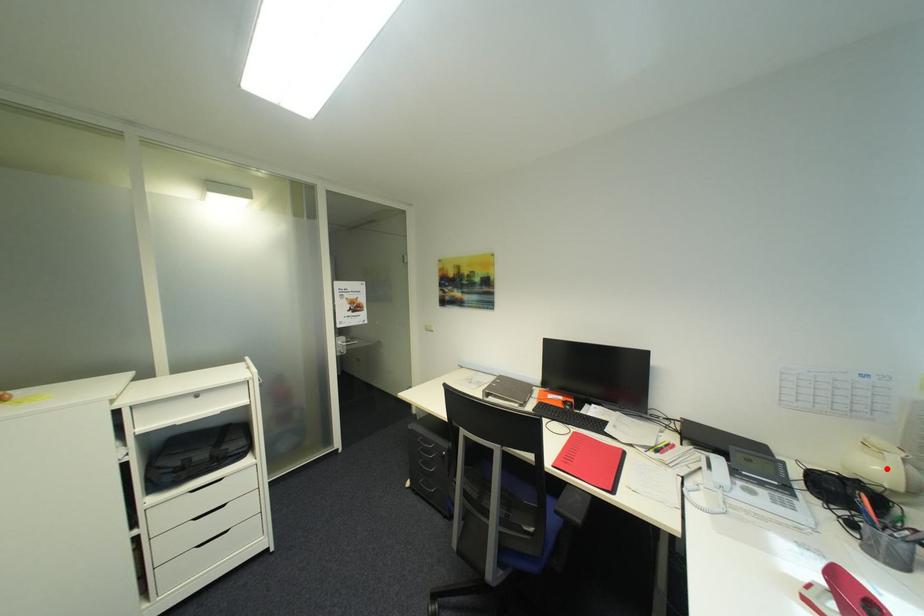
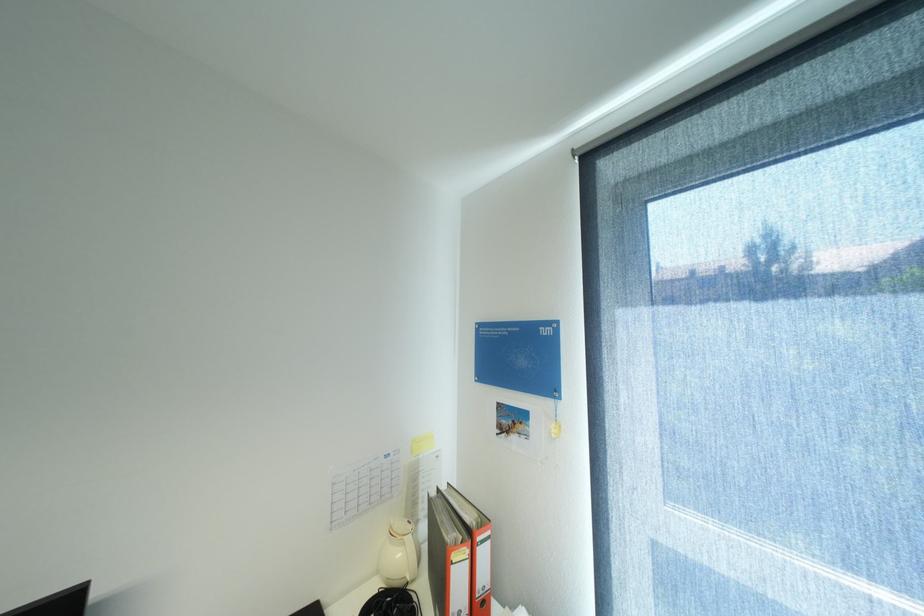
The point at the highlighted location is marked in the first image. Where is the corresponding point in the second image?

(407, 554)